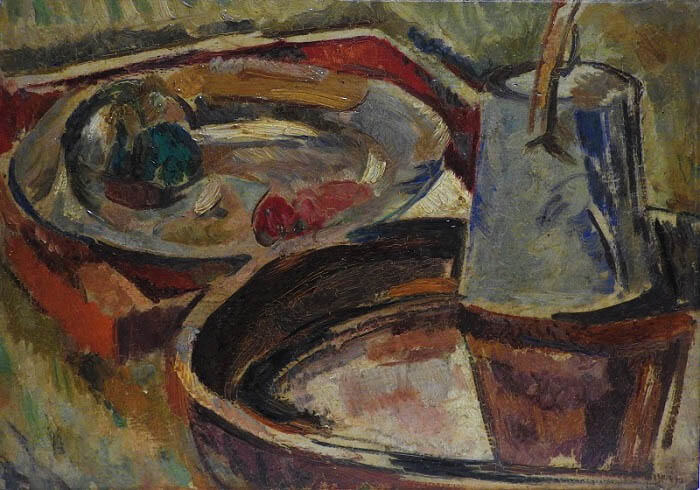
You are a GUI agent. You are given a task and a screenshot of the screen. Output one action in this format:
    pyautogui.click(x=<x>, y=<y>)
    Task: Click on the spoon
    
    Given the screenshot: What is the action you would take?
    pyautogui.click(x=322, y=93)